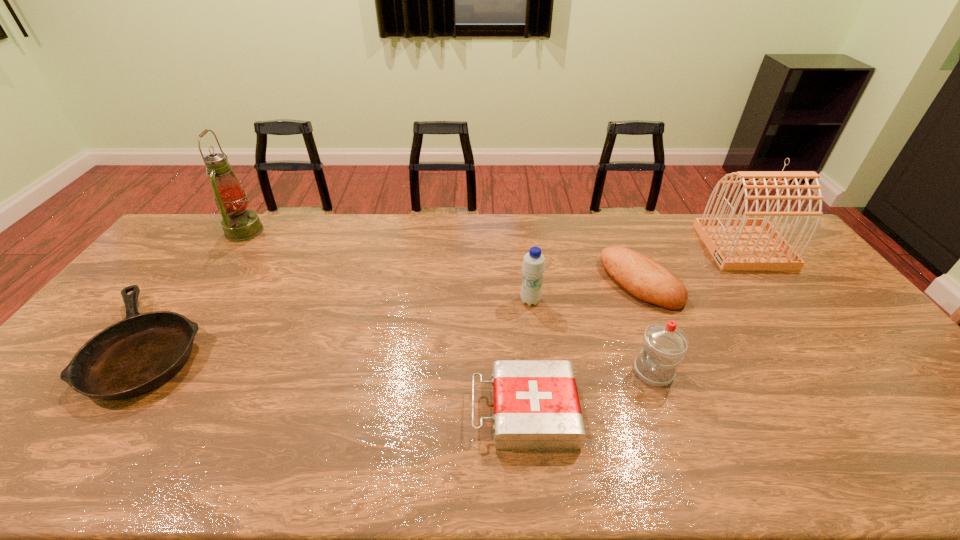
Identify the location of oil lamp. (239, 224).

Image resolution: width=960 pixels, height=540 pixels. I want to click on birdcage, so click(x=745, y=243).

I want to click on the left water bottle, so click(533, 267).

Where is `the right water bottle`? the right water bottle is located at coordinates pos(664,344).

Where is `bread`? The image size is (960, 540). bread is located at coordinates (643, 278).

Image resolution: width=960 pixels, height=540 pixels. Identify the location of the first-aid kit. (536, 405).

In order to click on the shortest object in this screenshot , I will do `click(134, 356)`.

Locate an element on the screen. This screenshot has width=960, height=540. blank area located 0.260m on the front of the oil lamp is located at coordinates (200, 296).

Image resolution: width=960 pixels, height=540 pixels. Find the location of `free space located 0.290m with an open door on the rightmost object`. free space located 0.290m with an open door on the rightmost object is located at coordinates (624, 246).

Where is `free spot located 0.290m with an open door on the rightmost object`? The width and height of the screenshot is (960, 540). free spot located 0.290m with an open door on the rightmost object is located at coordinates click(624, 246).